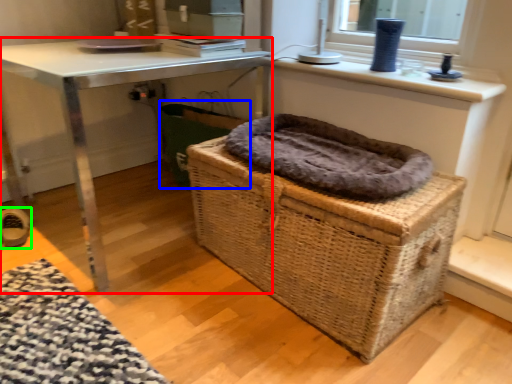
Question: Based on their relative distances, which object is nearer to table (highlighted by a red box)? Choose from laundry basket (highlighted by a blue box) and shoe (highlighted by a green box).

Choices:
 (A) laundry basket
 (B) shoe

Answer: (A)